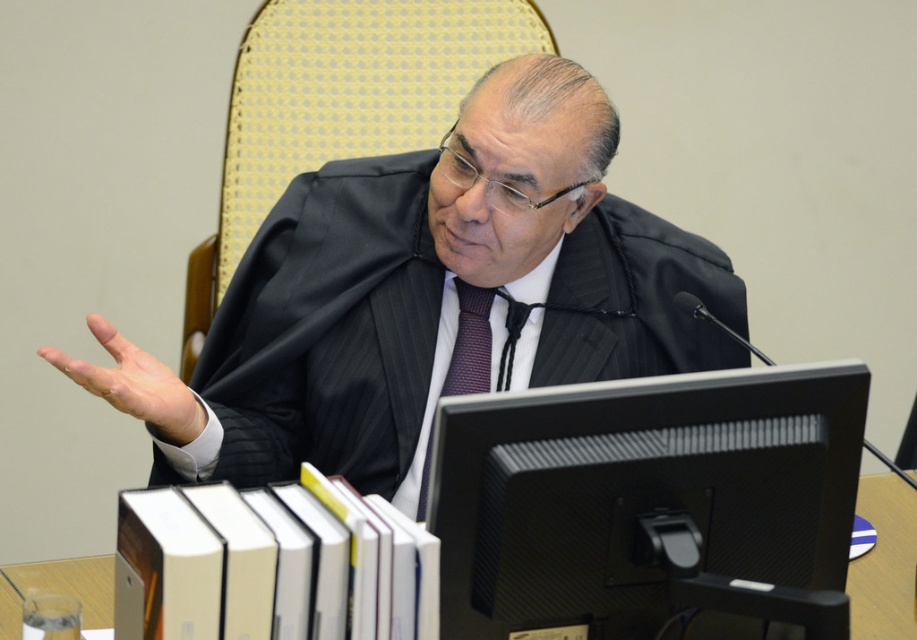
Is point (208, 378) positioned after point (460, 307)?

Yes, it is.

The image size is (917, 640). Describe the element at coordinates (327, 337) in the screenshot. I see `black pinstripe suit at center` at that location.

What do you see at coordinates (327, 337) in the screenshot?
I see `black pinstripe suit at center` at bounding box center [327, 337].

I want to click on black pinstripe suit at center, so click(x=327, y=337).

Is black pinstripe suit at center positioned at the back of white paper at lower center?

That is False.

Identify the location of black pinstripe suit at center. This screenshot has width=917, height=640. (327, 337).

Where is `black pinstripe suit at center`? black pinstripe suit at center is located at coordinates (327, 337).

Where is `black pinstripe suit at center`? The width and height of the screenshot is (917, 640). black pinstripe suit at center is located at coordinates (327, 337).

Is point (816, 557) behind point (417, 516)?

No, (816, 557) is closer to viewer.

This screenshot has width=917, height=640. Identify the location of black matte computer monitor at center. (650, 506).